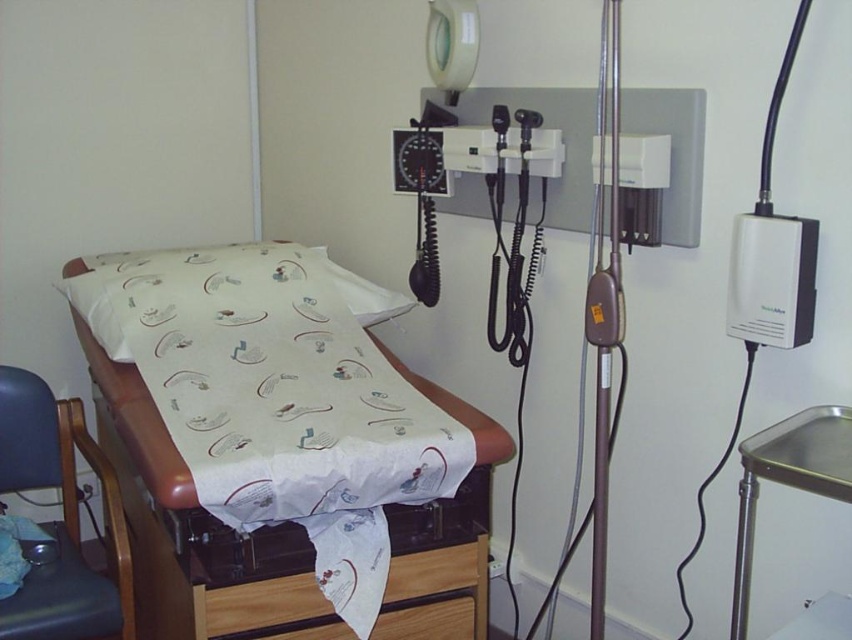
Question: Considering the relative positions of blue fabric chair at lower left and wooden drawer at lower center in the image provided, where is blue fabric chair at lower left located with respect to wooden drawer at lower center?

Choices:
 (A) left
 (B) right

Answer: (A)

Question: Is the position of wooden drawer at lower center less distant than that of metallic tray at right?

Choices:
 (A) no
 (B) yes

Answer: (A)

Question: Based on their relative distances, which object is nearer to the blue fabric chair at lower left?

Choices:
 (A) white printed fabric at center
 (B) metallic tray at right

Answer: (A)

Question: Which object is the farthest from the metallic tray at right?

Choices:
 (A) white printed fabric at center
 (B) wooden drawer at lower center

Answer: (A)

Question: Does white printed fabric at center lie behind blue fabric chair at lower left?

Choices:
 (A) no
 (B) yes

Answer: (A)

Question: Which point is farther to the camera?

Choices:
 (A) (461, 637)
 (B) (27, 438)

Answer: (B)